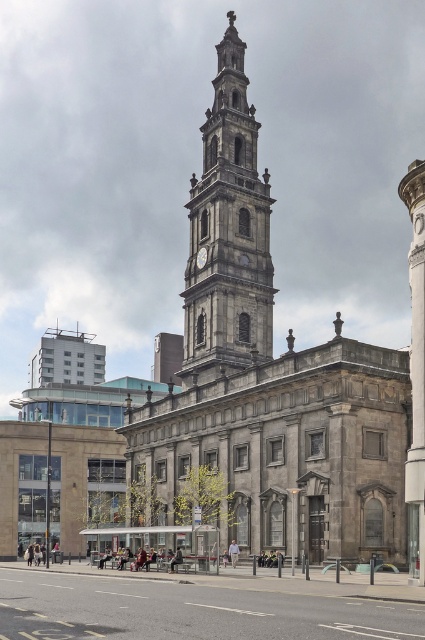
Question: Is stone clock tower at center wider than gold metallic clock at center?

Choices:
 (A) yes
 (B) no

Answer: (A)

Question: Does stone clock tower at center appear on the left side of gold metallic clock at center?

Choices:
 (A) yes
 (B) no

Answer: (B)

Question: Among these objects, which one is nearest to the camera?

Choices:
 (A) gold metallic clock at center
 (B) gray stone church at center
 (C) stone clock tower at center
 (D) concrete pavement at lower center

Answer: (D)

Question: Which object is positioned farthest from the gold metallic clock at center?

Choices:
 (A) gray stone church at center
 (B) concrete pavement at lower center

Answer: (B)

Question: Does concrete pavement at lower center have a larger size compared to gold metallic clock at center?

Choices:
 (A) yes
 (B) no

Answer: (A)

Question: Which of the following is the closest to the observer?

Choices:
 (A) (359, 556)
 (B) (260, 186)
 (C) (31, 609)
 (D) (203, 252)

Answer: (C)